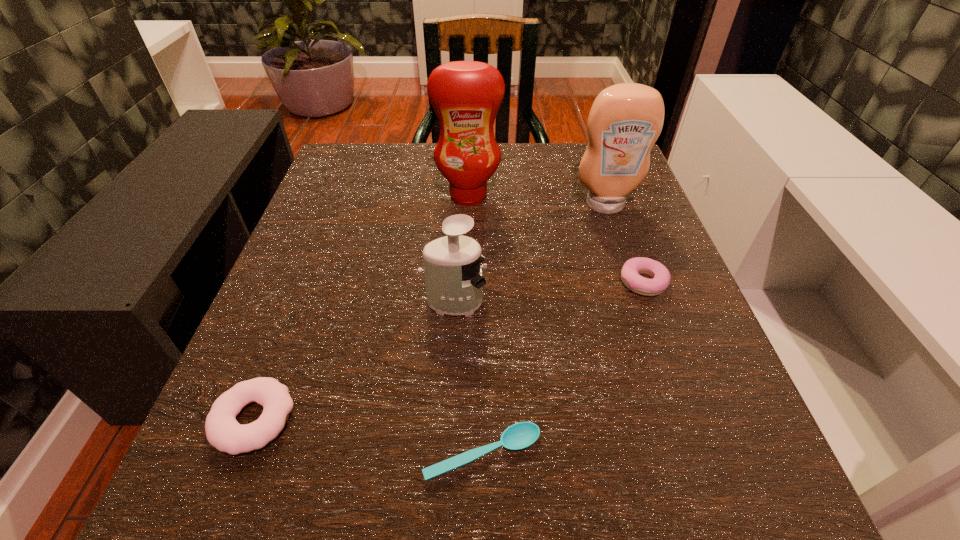
The width and height of the screenshot is (960, 540). I want to click on the left condiment, so click(x=466, y=95).

Find the location of a particular element. The image size is (960, 540). the right condiment is located at coordinates (625, 120).

The height and width of the screenshot is (540, 960). Identify the location of juicer. (453, 277).

The width and height of the screenshot is (960, 540). In order to click on pastry in this screenshot , I will do `click(633, 267)`.

In order to click on doughnut in this screenshot , I will do `click(223, 432)`.

This screenshot has height=540, width=960. Identify the location of the shortest object. 521,435.

This screenshot has height=540, width=960. What are the coordinates of `vacant area situated on the label side of the left condiment` in the screenshot? It's located at (467, 249).

In order to click on vacant region located on the label of the right condiment in this screenshot , I will do `click(656, 354)`.

Image resolution: width=960 pixels, height=540 pixels. I want to click on vacant position located on the right of the juicer, so click(x=624, y=302).

I want to click on vacant space positioned on the front of the pastry, so click(x=705, y=451).